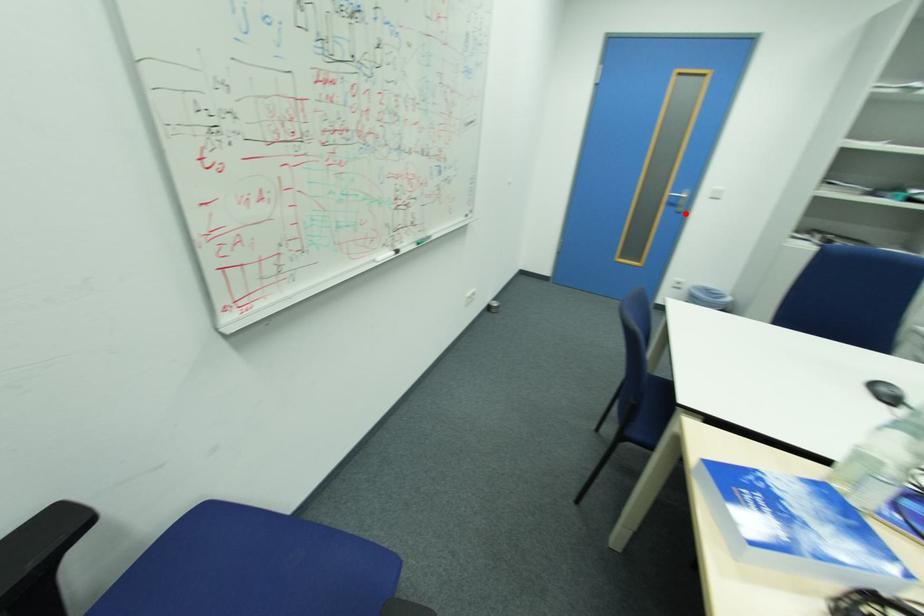
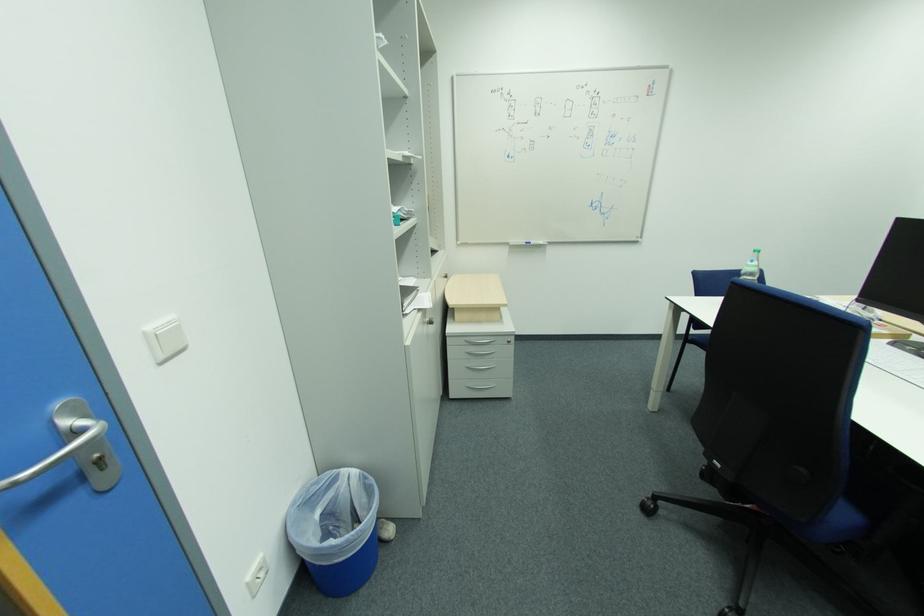
Find the pixel in the second image that matches the highlighted location in the first image.

(111, 488)